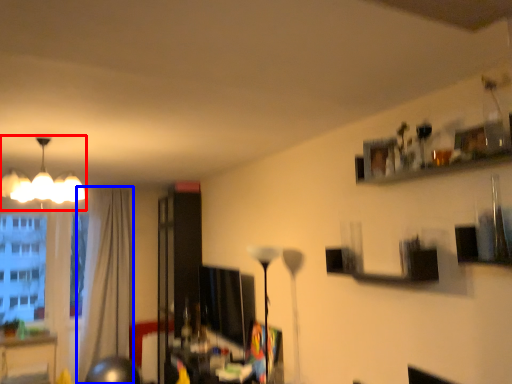
Question: Among these objects, which one is farthest to the camera, lamp (highlighted by a red box) or curtain (highlighted by a blue box)?

Choices:
 (A) lamp
 (B) curtain

Answer: (B)